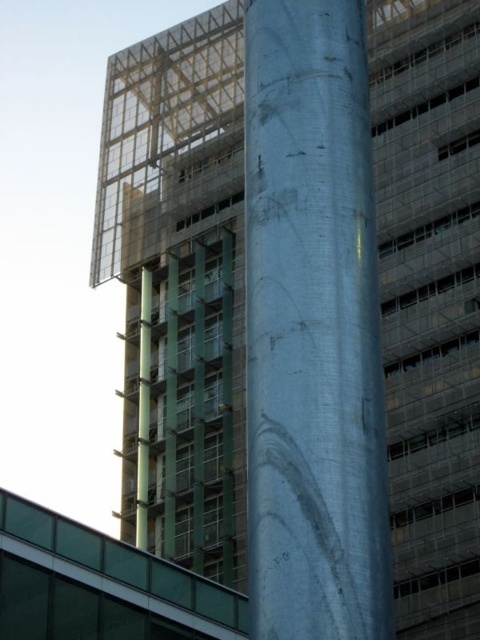
You are a construction worker standing at the entrance of the construction site. You see the metallic silver pole at center and the green glass pole at center. Which pole is closer to you?

The metallic silver pole at center is closer to you because it is in front of the green glass pole at center.

You are a construction worker standing at the base of the building. You notice two points marked on the construction site plan. The first point is at coordinate point (352,285), and the second is at coordinate point (146,541). If you were to walk from the first point to the second, would you be moving towards the building or away from it?

Since point (352,285) is in front of point (146,541), moving from the first point to the second would mean moving away from the building.